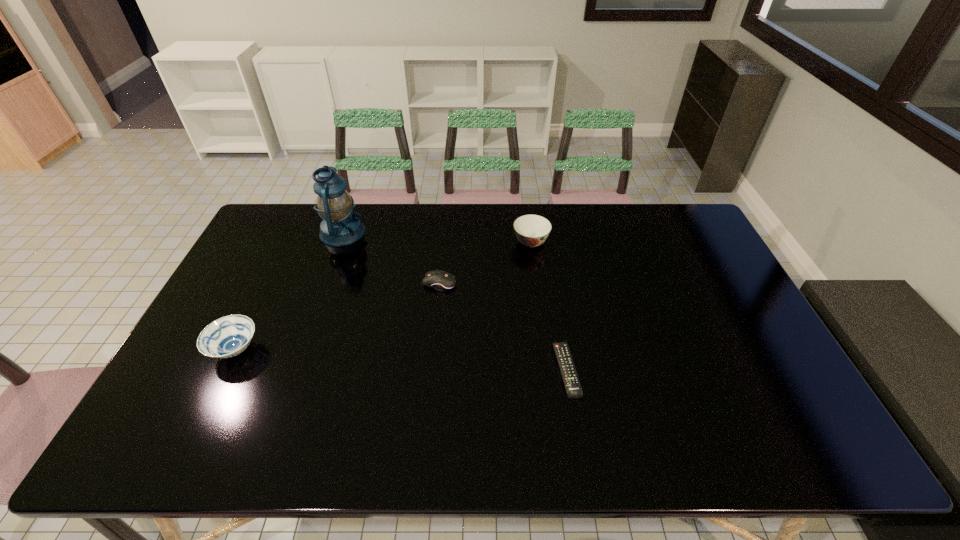
Where is `free space that satisfies the following two spatial constraints: 1. on the back side of the remote control; 2. on the face of the lantern`? This screenshot has height=540, width=960. free space that satisfies the following two spatial constraints: 1. on the back side of the remote control; 2. on the face of the lantern is located at coordinates (543, 233).

Locate an element on the screen. This screenshot has width=960, height=540. vacant area in the image that satisfies the following two spatial constraints: 1. on the face of the lantern; 2. on the back side of the farther soup bowl is located at coordinates (339, 242).